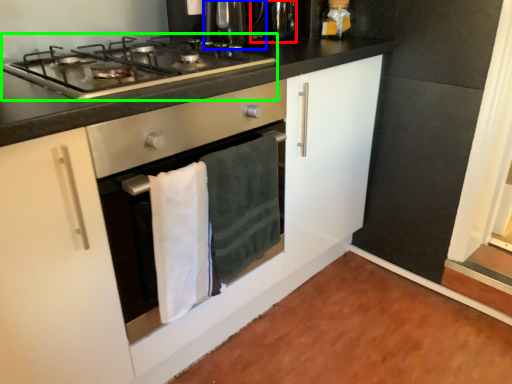
Question: Which object is the closest to the appliance (highlighted by a red box)? Choose among these: coffee machine (highlighted by a blue box) or gas stove (highlighted by a green box).

Choices:
 (A) coffee machine
 (B) gas stove

Answer: (A)